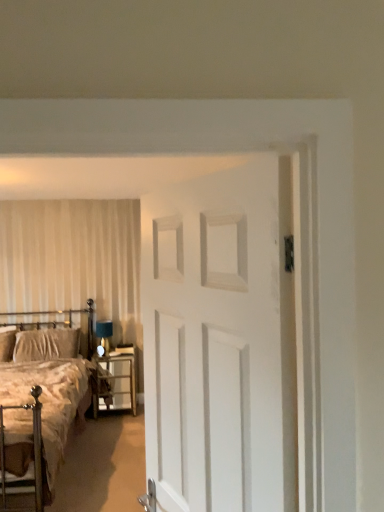
Question: Is metallic gold bed at left a part of metallic silver headboard at left?

Choices:
 (A) no
 (B) yes

Answer: (A)

Question: Considering the relative sizes of metallic silver headboard at left and metallic gold bed at left in the image provided, is metallic silver headboard at left wider than metallic gold bed at left?

Choices:
 (A) yes
 (B) no

Answer: (B)

Question: From the image's perspective, would you say metallic silver headboard at left is shown under metallic gold bed at left?

Choices:
 (A) yes
 (B) no

Answer: (B)

Question: Is metallic silver headboard at left behind metallic gold bed at left?

Choices:
 (A) no
 (B) yes

Answer: (B)

Question: From the image's perspective, would you say metallic silver headboard at left is positioned over metallic gold bed at left?

Choices:
 (A) no
 (B) yes

Answer: (B)

Question: From a real-world perspective, is metallic silver headboard at left physically above metallic gold bed at left?

Choices:
 (A) no
 (B) yes

Answer: (B)

Question: Can you see metallic gold bed at left touching metallic silver nightstand at lower center?

Choices:
 (A) yes
 (B) no

Answer: (B)

Question: Is metallic gold bed at left at the right side of metallic silver nightstand at lower center?

Choices:
 (A) yes
 (B) no

Answer: (B)

Question: Is metallic gold bed at left wider than metallic silver nightstand at lower center?

Choices:
 (A) no
 (B) yes

Answer: (B)

Question: From a real-world perspective, is metallic gold bed at left physically above metallic silver nightstand at lower center?

Choices:
 (A) yes
 (B) no

Answer: (A)

Question: Can you confirm if metallic gold bed at left is shorter than metallic silver nightstand at lower center?

Choices:
 (A) yes
 (B) no

Answer: (B)

Question: Is metallic gold bed at left outside of metallic silver nightstand at lower center?

Choices:
 (A) no
 (B) yes

Answer: (B)

Question: From a real-world perspective, is metallic silver nightstand at lower center physically above velvet beige pillow at left?

Choices:
 (A) yes
 (B) no

Answer: (B)